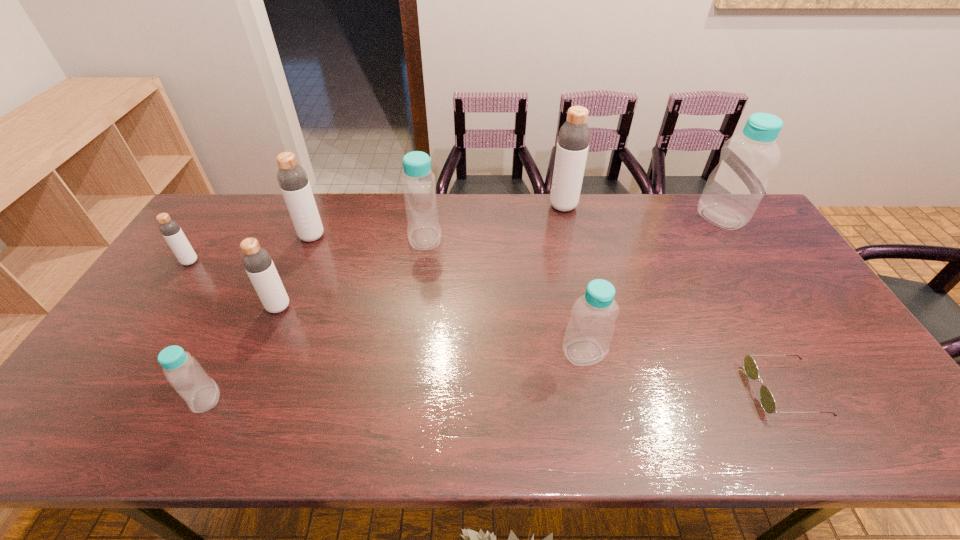
Locate an element on the screen. The height and width of the screenshot is (540, 960). object that is at the left edge is located at coordinates (170, 229).

Find the location of a particular element. The width and height of the screenshot is (960, 540). bottle that is at the right edge is located at coordinates (734, 189).

Where is `sunglasses at the right edge`? The image size is (960, 540). sunglasses at the right edge is located at coordinates (767, 401).

Image resolution: width=960 pixels, height=540 pixels. Find the location of `object present at the far right corner`. object present at the far right corner is located at coordinates (734, 189).

Where is `object present at the near right corner`? The image size is (960, 540). object present at the near right corner is located at coordinates (767, 401).

Find the location of `free spot at the far edge of the desktop`. free spot at the far edge of the desktop is located at coordinates (374, 196).

You are a GUI agent. You are given a task and a screenshot of the screen. Output one action in this format:
    pyautogui.click(x=<x>, y=<y>)
    Task: Click on the vacant space at the left edge of the desktop
    
    Given the screenshot: What is the action you would take?
    pyautogui.click(x=155, y=362)

This screenshot has width=960, height=540. In the image, there is a desktop. In order to click on vacant space at the right edge in this screenshot , I will do `click(889, 409)`.

This screenshot has width=960, height=540. I want to click on free space at the near right corner, so click(x=852, y=442).

At what (x,y) coordinates should I click in order to perform the action: click on free spot between the nearest bottle and the smallest gray bottle. Please return your answer as a coordinate pair (x, y). Looking at the image, I should click on (198, 330).